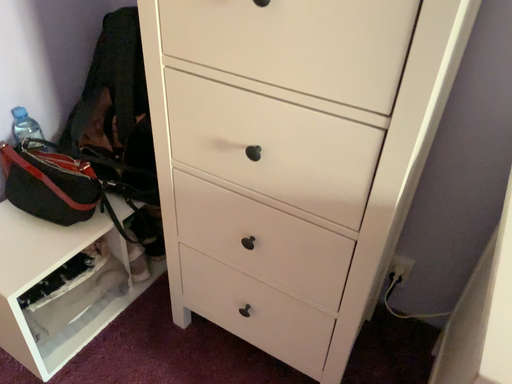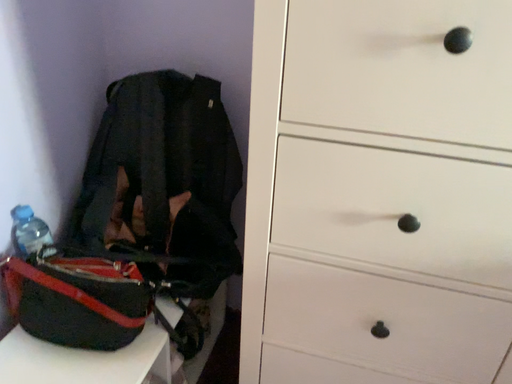
Question: Which way did the camera rotate in the video?

Choices:
 (A) rotated upward
 (B) rotated downward

Answer: (A)